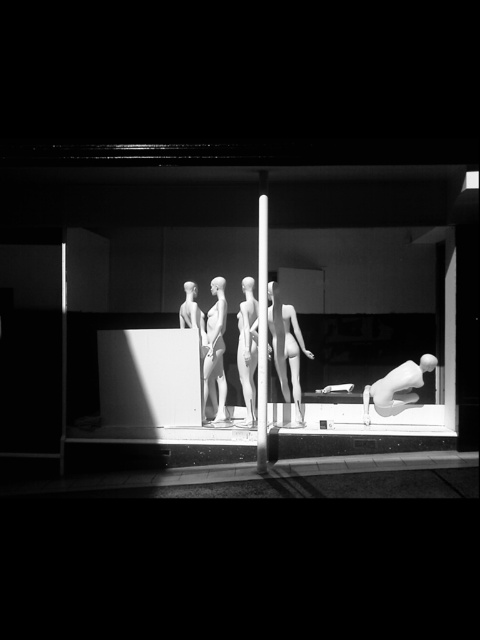
Question: Which of the following is the farthest from the observer?

Choices:
 (A) white glossy pole at center
 (B) matte white mannequin at center

Answer: (B)

Question: Is white glossy pole at center smaller than matte white mannequin at center?

Choices:
 (A) no
 (B) yes

Answer: (B)

Question: Which point is closer to the camera?

Choices:
 (A) matte white mannequin at center
 (B) white glossy pole at center

Answer: (B)

Question: Does white glossy pole at center have a greater width compared to matte white mannequin at center?

Choices:
 (A) yes
 (B) no

Answer: (B)

Question: Does white glossy pole at center come behind matte white mannequin at center?

Choices:
 (A) no
 (B) yes

Answer: (A)